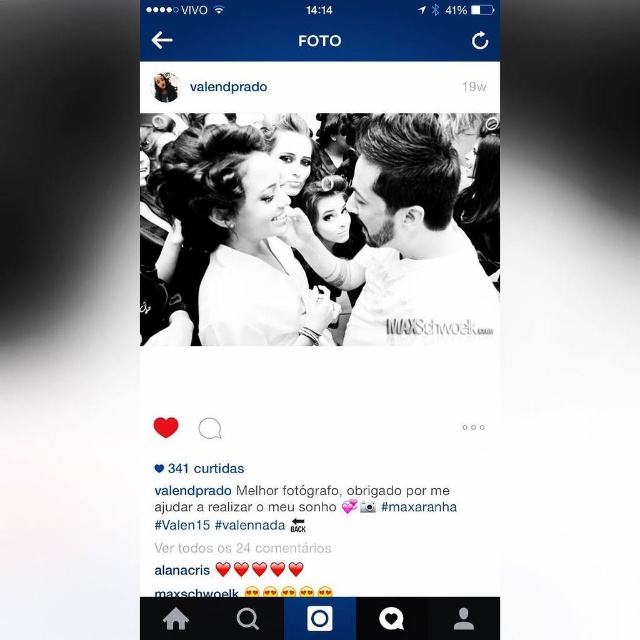
Question: Can you confirm if white matte dress at center is bigger than white matte text at center?

Choices:
 (A) yes
 (B) no

Answer: (A)

Question: Does matte white hair at center appear on the right side of white matte text at center?

Choices:
 (A) yes
 (B) no

Answer: (B)

Question: Which of the following is the closest to the observer?

Choices:
 (A) white matte text at center
 (B) matte white hair at center

Answer: (A)

Question: Among these points, which one is farthest from the camera?

Choices:
 (A) (248, 188)
 (B) (474, 339)
 (C) (396, 500)

Answer: (A)

Question: Which point appears farthest from the camera in this image?

Choices:
 (A) (435, 509)
 (B) (225, 160)
 (C) (227, 237)

Answer: (C)

Question: Does matte white hair at center have a lesser width compared to white matte text at center?

Choices:
 (A) no
 (B) yes

Answer: (A)